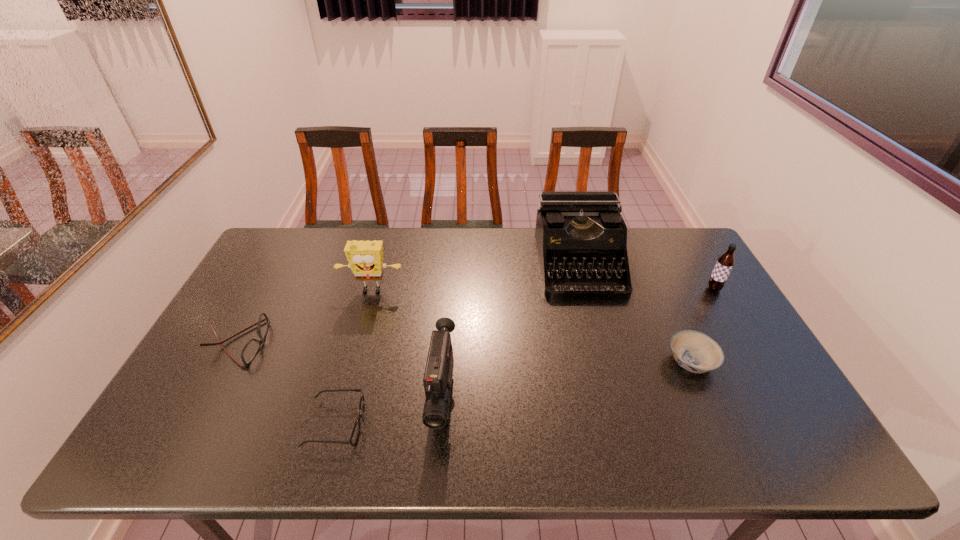
Locate an element on the screen. free space that is in between the fourth object from right to left and the sponge is located at coordinates (407, 345).

You are a GUI agent. You are given a task and a screenshot of the screen. Output one action in this format:
    pyautogui.click(x=<x>, y=<y>)
    Task: Click on the free space between the nearer spectacles and the leftmost object
    Image resolution: width=960 pixels, height=540 pixels.
    Given the screenshot: What is the action you would take?
    pyautogui.click(x=286, y=384)

The image size is (960, 540). I want to click on free space between the fourth object from right to left and the bowl, so click(566, 380).

Image resolution: width=960 pixels, height=540 pixels. I want to click on free space between the leftmost object and the sixth object from left to right, so click(464, 353).

I want to click on free space between the bowl and the fourth object from right to left, so click(566, 380).

The image size is (960, 540). In order to click on free space between the typewriter and the sponge in this screenshot , I will do `click(474, 278)`.

Find the location of a particular element. object that is the second closest one to the sixth object from left to right is located at coordinates (725, 263).

Choose which object is the nearest neighbor to the typewriter. Please provide its 2D coordinates. Your answer should be formatted as a tuple, i.e. [(x, y)], where the tuple contains the x and y coordinates of a point satisfying the conditions above.

[(696, 352)]

In order to click on vacant position in the image that satisfies the following two spatial constraints: 1. on the typing side of the third object from right to left; 2. on the front-facing side of the leftmost object in this screenshot , I will do `click(599, 343)`.

Where is `free region that satisfies the following two spatial constraints: 1. on the front-facing side of the sixth object from left to right; 2. on the right side of the sponge`? This screenshot has height=540, width=960. free region that satisfies the following two spatial constraints: 1. on the front-facing side of the sixth object from left to right; 2. on the right side of the sponge is located at coordinates (352, 362).